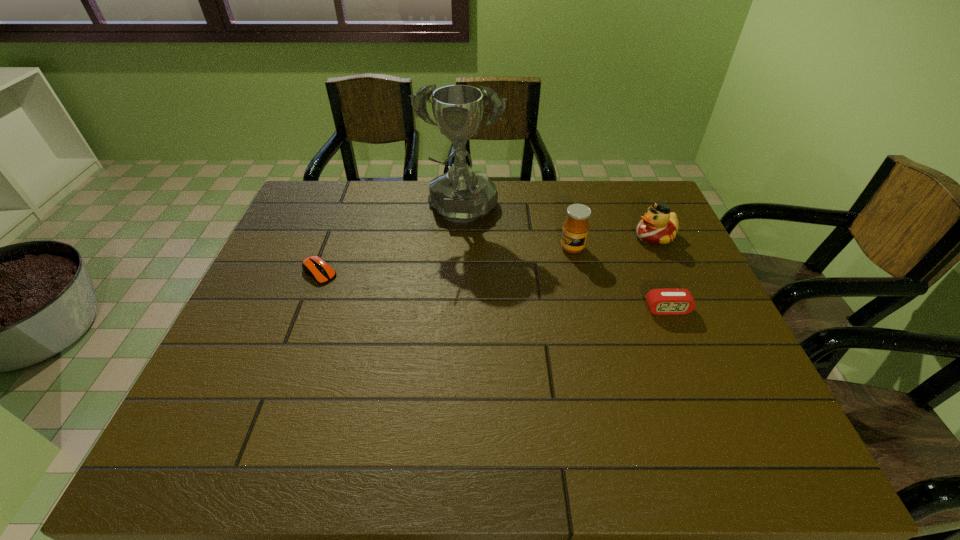
Where is `object present at the left edge`? object present at the left edge is located at coordinates (316, 267).

At what (x,y) coordinates should I click in order to perform the action: click on alarm clock located at the right edge. Please return your answer as a coordinate pair (x, y). This screenshot has width=960, height=540. Looking at the image, I should click on (670, 301).

This screenshot has width=960, height=540. I want to click on duck that is at the right edge, so click(x=658, y=226).

Identify the location of vacant space at the far edge. This screenshot has height=540, width=960. (546, 200).

The height and width of the screenshot is (540, 960). In the image, there is a desktop. What are the coordinates of `vacant space at the near edge` in the screenshot? It's located at (426, 396).

Where is `vacant space at the left edge of the desktop`? Image resolution: width=960 pixels, height=540 pixels. vacant space at the left edge of the desktop is located at coordinates (247, 335).

You are a GUI agent. You are given a task and a screenshot of the screen. Output one action in this format:
    pyautogui.click(x=<x>, y=<y>)
    Task: Click on the vacant space at the right edge
    
    Given the screenshot: What is the action you would take?
    pyautogui.click(x=665, y=267)

This screenshot has width=960, height=540. In order to click on vacant space at the far left corner in this screenshot , I will do `click(349, 195)`.

Locate an element on the screen. Image resolution: width=960 pixels, height=540 pixels. vacant area at the near left corner of the desktop is located at coordinates (225, 403).

This screenshot has height=540, width=960. I want to click on vacant area between the third object from left to right and the second shortest object, so click(620, 279).